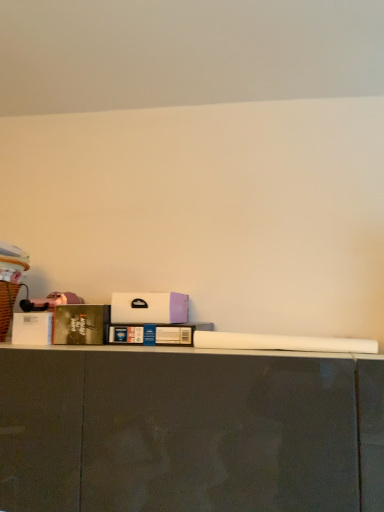
Question: Does blue cardboard book at center, which is counted as the second book, starting from the left, have a smaller size compared to hardcover book at left, the 1th book in the left-to-right sequence?

Choices:
 (A) no
 (B) yes

Answer: (A)

Question: From the image's perspective, is blue cardboard book at center, which appears as the 1th book when viewed from the right, above hardcover book at left, the 1th book in the left-to-right sequence?

Choices:
 (A) no
 (B) yes

Answer: (A)

Question: From a real-world perspective, is blue cardboard book at center, which is counted as the second book, starting from the left, beneath hardcover book at left, the 2th book in the right-to-left sequence?

Choices:
 (A) yes
 (B) no

Answer: (A)

Question: From the image's perspective, would you say blue cardboard book at center, which appears as the 1th book when viewed from the right, is shown under hardcover book at left, the 1th book in the left-to-right sequence?

Choices:
 (A) no
 (B) yes

Answer: (B)

Question: Does blue cardboard book at center, which appears as the 1th book when viewed from the right, have a lesser width compared to hardcover book at left, the 2th book in the right-to-left sequence?

Choices:
 (A) yes
 (B) no

Answer: (B)

Question: Considering their positions, is white matte box at center located in front of or behind hardcover book at left, the 1th book in the left-to-right sequence?

Choices:
 (A) behind
 (B) front

Answer: (B)

Question: Is white matte box at center inside or outside of hardcover book at left, the 2th book in the right-to-left sequence?

Choices:
 (A) outside
 (B) inside

Answer: (A)

Question: Visually, is white matte box at center positioned to the left or to the right of hardcover book at left, the 1th book in the left-to-right sequence?

Choices:
 (A) left
 (B) right

Answer: (B)

Question: From the image's perspective, relative to hardcover book at left, the 1th book in the left-to-right sequence, is white matte box at center above or below?

Choices:
 (A) below
 (B) above

Answer: (B)

Question: In terms of height, does white matte box at center look taller or shorter compared to brown wicker laundry basket at left?

Choices:
 (A) tall
 (B) short

Answer: (B)

Question: Relative to brown wicker laundry basket at left, is white matte box at center in front or behind?

Choices:
 (A) behind
 (B) front

Answer: (A)

Question: Is point (167, 321) closer or farther from the camera than point (8, 249)?

Choices:
 (A) farther
 (B) closer

Answer: (B)

Question: From the image's perspective, is white matte box at center positioned above or below brown wicker laundry basket at left?

Choices:
 (A) above
 (B) below

Answer: (B)

Question: From the image's perspective, relative to blue cardboard book at center, which is counted as the second book, starting from the left, is brown wicker laundry basket at left above or below?

Choices:
 (A) below
 (B) above

Answer: (B)

Question: Is point (13, 281) positioned closer to the camera than point (122, 339)?

Choices:
 (A) farther
 (B) closer

Answer: (A)